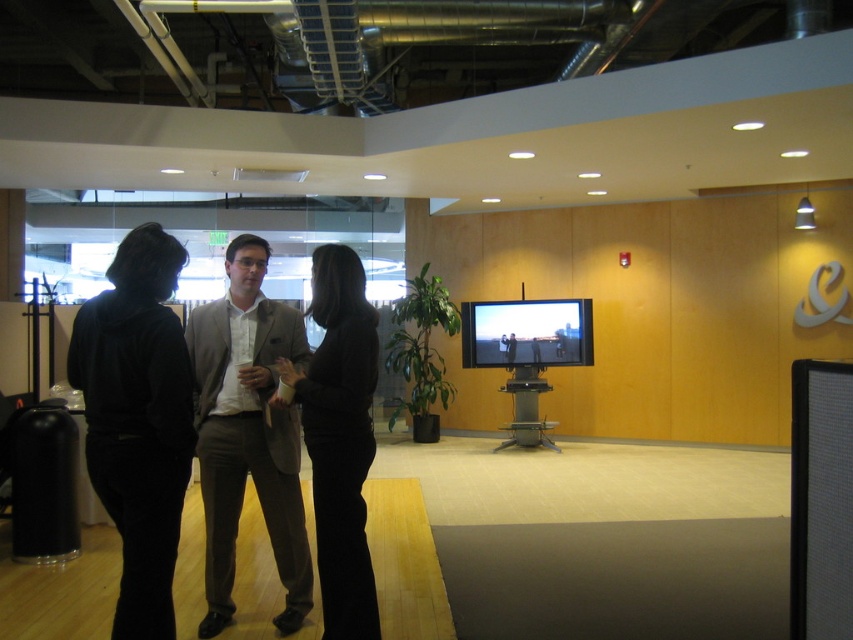
Is gray wool suit at center taller than black matte pants at center?

Yes, gray wool suit at center is taller than black matte pants at center.

Between gray wool suit at center and black matte pants at center, which one appears on the right side from the viewer's perspective?

From the viewer's perspective, black matte pants at center appears more on the right side.

Between point (288, 500) and point (347, 412), which one is positioned behind?

Positioned behind is point (288, 500).

Locate an element on the screen. gray wool suit at center is located at coordinates tap(248, 433).

Does black matte pants at left come behind black matte pants at center?

No, it is in front of black matte pants at center.

Who is taller, black matte pants at left or black matte pants at center?

black matte pants at center

What do you see at coordinates (138, 420) in the screenshot?
I see `black matte pants at left` at bounding box center [138, 420].

Find the location of `black matte pants at left`. black matte pants at left is located at coordinates (138, 420).

Can you confirm if dark gray suit at center is positioned to the right of gray wool suit at center?

Indeed, dark gray suit at center is positioned on the right side of gray wool suit at center.

Which of these two, dark gray suit at center or gray wool suit at center, stands taller?

gray wool suit at center is taller.

Between point (148, 618) and point (219, 557), which one is positioned behind?

The point (219, 557) is more distant.

The width and height of the screenshot is (853, 640). Find the location of `dark gray suit at center`. dark gray suit at center is located at coordinates (192, 419).